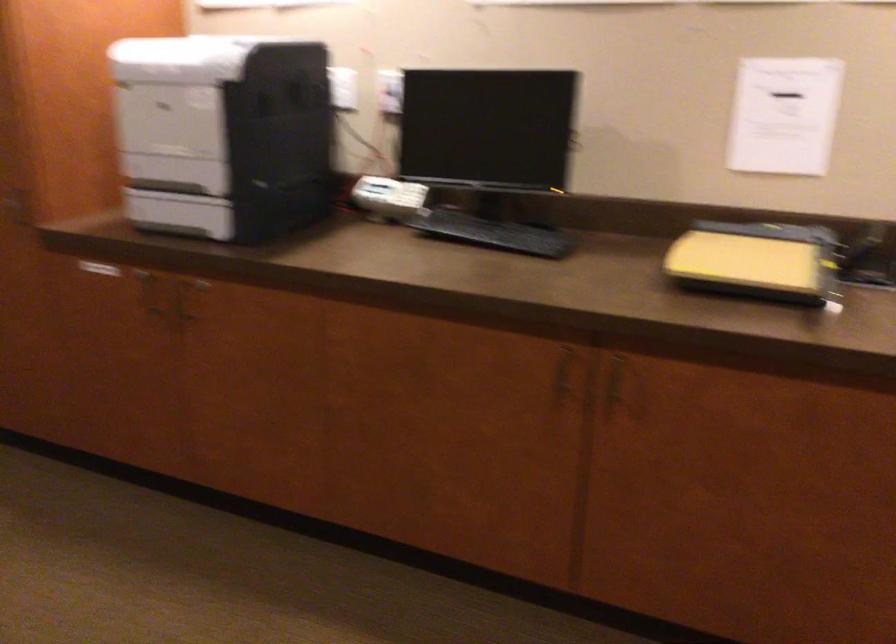
Locate an element on the screen. The height and width of the screenshot is (644, 896). printer drawer handle is located at coordinates 169,151.